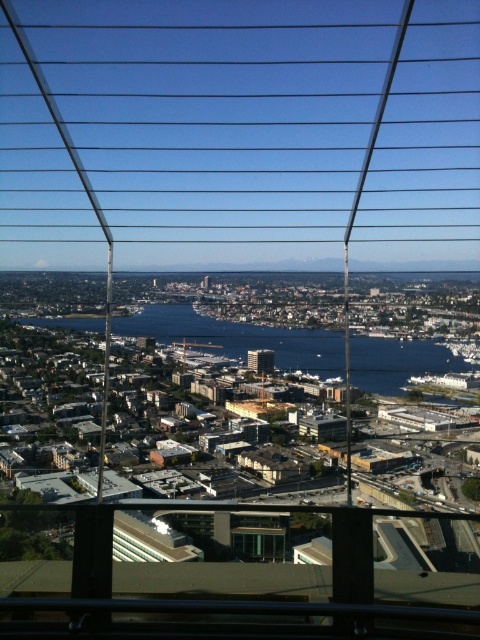
Question: From the image, what is the correct spatial relationship of transparent glass window at center in relation to clear glass window at center?

Choices:
 (A) left
 (B) right

Answer: (B)

Question: Which point appears farthest from the camera in this image?

Choices:
 (A) (279, 560)
 (B) (152, 541)

Answer: (B)

Question: Estimate the real-world distances between objects in this image. Which object is closer to the clear glass window at center?

Choices:
 (A) blue water at center
 (B) transparent glass window at center

Answer: (B)

Question: Is blue water at center below clear glass window at center?

Choices:
 (A) no
 (B) yes

Answer: (A)

Question: Does blue water at center have a lesser width compared to clear glass window at center?

Choices:
 (A) no
 (B) yes

Answer: (A)

Question: Estimate the real-world distances between objects in this image. Which object is farther from the clear glass window at center?

Choices:
 (A) blue water at center
 (B) transparent glass window at center

Answer: (A)